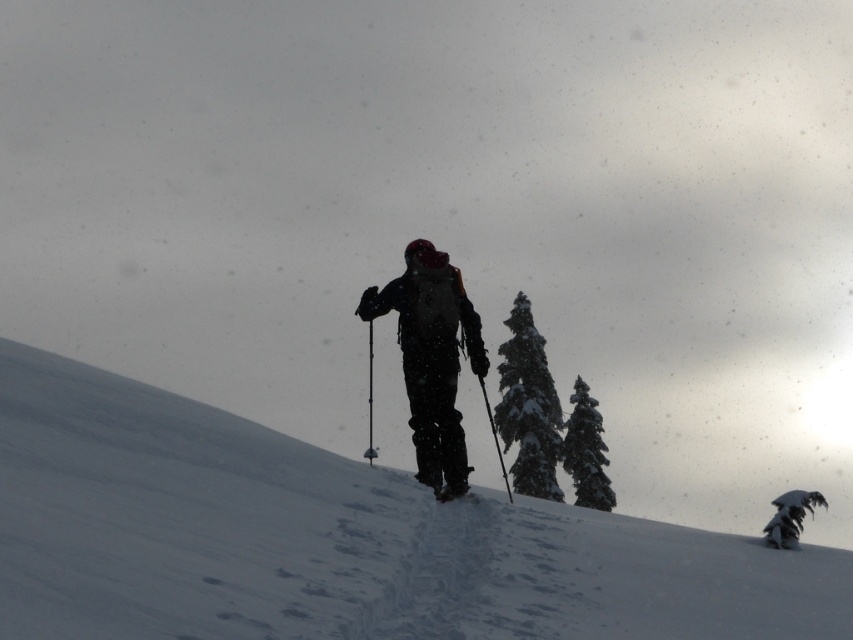
Question: Which object is closer to the camera taking this photo?

Choices:
 (A) snow-covered pine tree at center
 (B) green textured pine tree at upper right
 (C) dark matte ski suit at center

Answer: (C)

Question: Is dark matte ski suit at center to the right of green textured pine tree at upper right from the viewer's perspective?

Choices:
 (A) no
 (B) yes

Answer: (A)

Question: Which of these objects is positioned closest to the green textured pine tree at upper right?

Choices:
 (A) snow-covered pine tree at center
 (B) dark matte ski suit at center

Answer: (A)

Question: Which point is closer to the camera?

Choices:
 (A) green textured pine tree at upper right
 (B) matte black ski at center
 (C) snowy evergreen tree at center
 (D) snow-covered pine tree at center

Answer: (B)

Question: Is dark matte ski suit at center to the left of snowy evergreen tree at center from the viewer's perspective?

Choices:
 (A) no
 (B) yes

Answer: (B)

Question: Is snowy evergreen tree at center smaller than green textured pine tree at upper right?

Choices:
 (A) no
 (B) yes

Answer: (A)